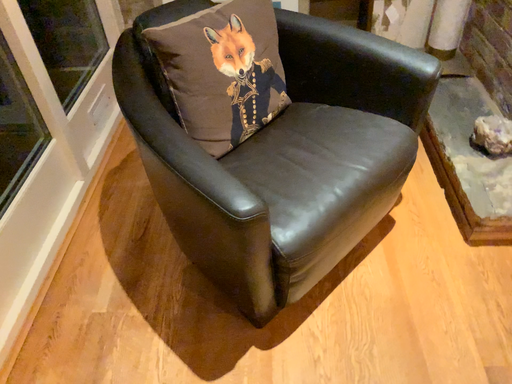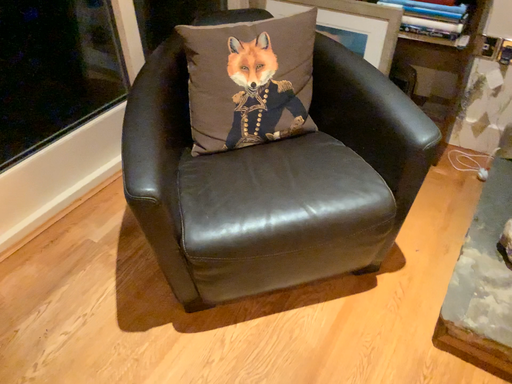
Question: Which way did the camera rotate in the video?

Choices:
 (A) rotated left
 (B) rotated right

Answer: (A)